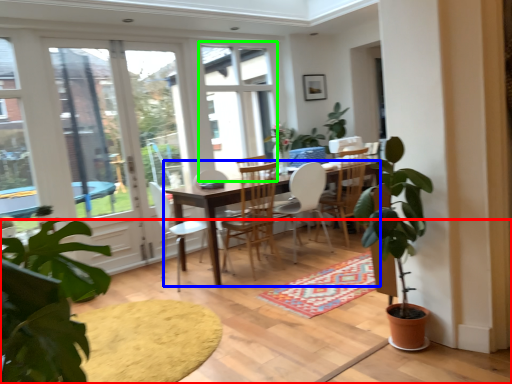
Question: Based on their relative distances, which object is farther from carpeting (highlighted by a red box)? Choose from desk (highlighted by a blue box) and window (highlighted by a green box).

Choices:
 (A) desk
 (B) window

Answer: (B)